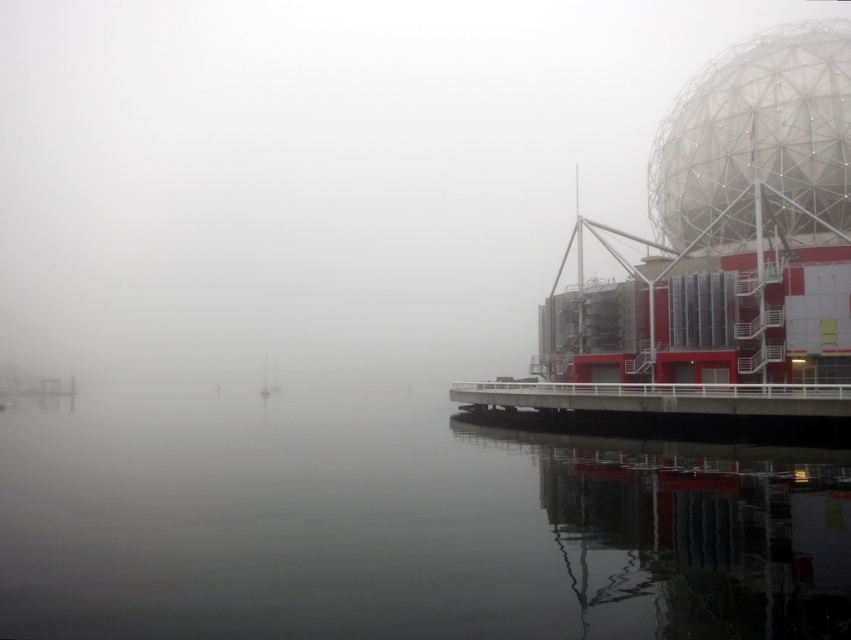
Who is more distant from viewer, (421, 438) or (480, 403)?

Positioned behind is point (480, 403).

Is smooth water at center smaller than white metal dock at lower right?

No, smooth water at center is not smaller than white metal dock at lower right.

Locate an element on the screen. The image size is (851, 640). smooth water at center is located at coordinates (398, 524).

Between white metallic dome at upper right and white metal dock at lower right, which one has less height?

With less height is white metal dock at lower right.

Which is below, white metallic dome at upper right or white metal dock at lower right?

white metal dock at lower right is lower down.

Is point (704, 163) positioned after point (638, 403)?

Yes, it is.

Where is `white metallic dome at upper right`? This screenshot has height=640, width=851. white metallic dome at upper right is located at coordinates (757, 131).

Does smooth water at center appear on the right side of white metallic dome at upper right?

No, smooth water at center is not to the right of white metallic dome at upper right.

Between smooth water at center and white metallic dome at upper right, which one appears on the left side from the viewer's perspective?

Positioned to the left is smooth water at center.

Is point (518, 595) positioned after point (815, 134)?

No, (518, 595) is closer to viewer.

At what (x,y) coordinates should I click in order to perform the action: click on smooth water at center. Please return your answer as a coordinate pair (x, y). The height and width of the screenshot is (640, 851). Looking at the image, I should click on (398, 524).